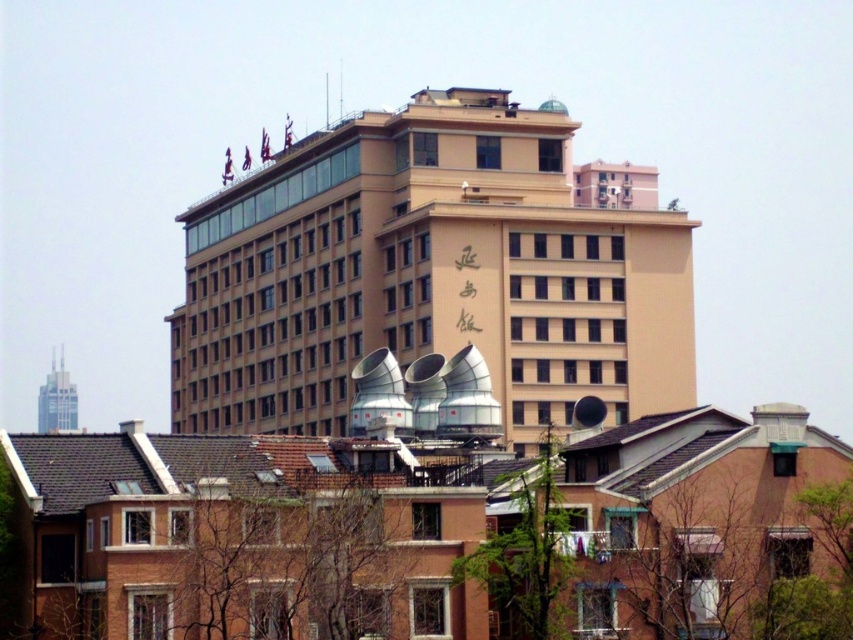
You are planning to install a new satellite dish on the tallest building in the scene. Based on the image, which building should you choose between the beige concrete building at center and the glassy steel skyscraper at upper left?

The beige concrete building at center is taller than the glassy steel skyscraper at upper left, so you should install the satellite dish on the beige concrete building at center.

You are a drone operator tasked with flying a drone between the beige concrete building at center and the glassy steel skyscraper at upper left. The drone has a maximum flight distance of 150 meters. Can the drone safely fly between these two structures without exceeding its range limit?

The beige concrete building at center and the glassy steel skyscraper at upper left are 153.32 meters apart from each other. Since the drone has a maximum flight distance of 150 meters, it cannot safely fly between these two structures without exceeding its range limit.

You are a city planner analyzing the urban layout. Based on the scene, which object is wider when comparing the beige concrete building at center and the glassy steel skyscraper at upper left?

The beige concrete building at center is wider than the glassy steel skyscraper at upper left according to the description provided.